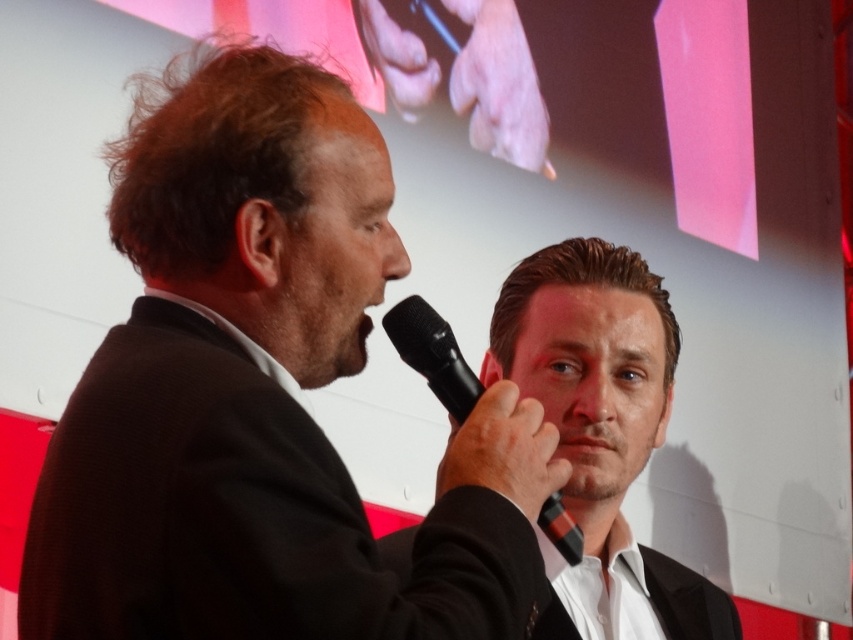
You are an event planner arranging seating for a presentation. There is a smooth black suit at center marked by point (602, 433). Where should you place the speaker so they can be seen clearly by the audience?

The speaker should be positioned in front of the smooth black suit at center marked by point (602, 433) to ensure they are visible to the audience.

You are an event organizer who needs to arrange seating for two guests based on their clothing. You have two chairs available, one that can accommodate up to 1.8 meters in height and another for shorter individuals. The guests are wearing the black matte suit at left and the smooth black suit at center. Which guest should sit in the chair designed for shorter people?

The black matte suit at left is not as tall as smooth black suit at center, so the guest in the black matte suit at left should sit in the chair designed for shorter people.

You are an event organizer who needs to adjust the stage setup. The stage currently has a smooth black suit at center and a black plastic microphone at center. According to the current arrangement, which object is positioned closer to the audience? Please provide your answer based on the spatial relationship between these two items.

The smooth black suit at center is closer to the audience because the black plastic microphone at center is positioned behind it.